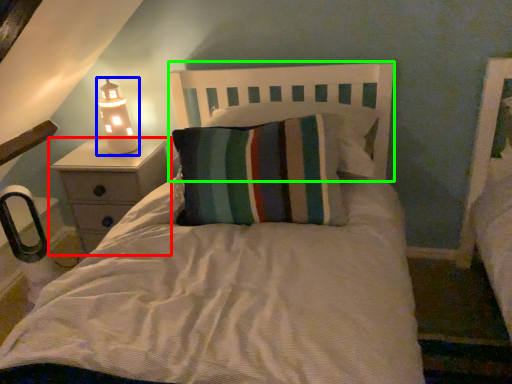
Question: Which object is the farthest from nightstand (highlighted by a red box)? Choose among these: lamp (highlighted by a blue box) or headboard (highlighted by a green box).

Choices:
 (A) lamp
 (B) headboard

Answer: (B)